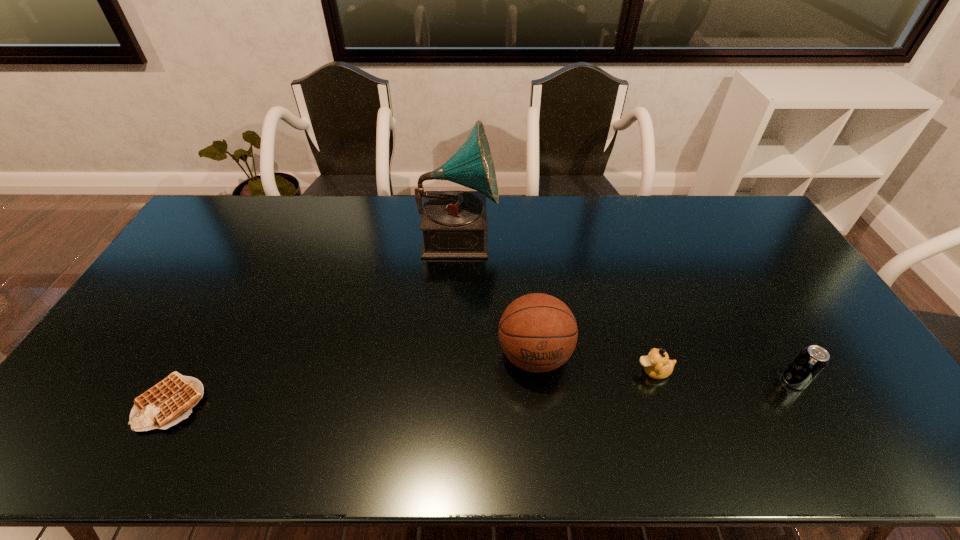
In order to click on the tallest object in this screenshot , I will do click(455, 224).

Image resolution: width=960 pixels, height=540 pixels. I want to click on record player, so coord(455,224).

I want to click on the fourth shortest object, so pos(538,333).

This screenshot has width=960, height=540. I want to click on the third tallest object, so click(811, 361).

This screenshot has width=960, height=540. Identify the location of the rightmost object. (811, 361).

You are a GUI agent. You are given a task and a screenshot of the screen. Output one action in this format:
    pyautogui.click(x=<x>, y=<y>)
    Task: Click on the fourth object from left to right
    
    Given the screenshot: What is the action you would take?
    pyautogui.click(x=657, y=365)

Locate an element on the screen. the second shortest object is located at coordinates pyautogui.click(x=657, y=365).

Identify the location of waffle. The height and width of the screenshot is (540, 960). click(x=170, y=401).

Locate an element on the screen. the shortest object is located at coordinates (170, 401).

You are a GUI agent. You are given a task and a screenshot of the screen. Output one action in this format:
    pyautogui.click(x=<x>, y=<y>)
    Task: Click on the free space located 0.070m on the horn of the record player
    Image resolution: width=960 pixels, height=540 pixels.
    Given the screenshot: What is the action you would take?
    (x=517, y=234)